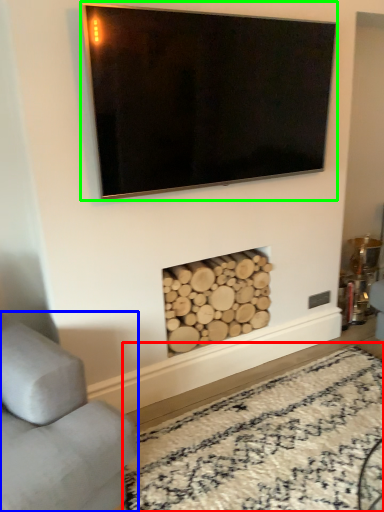
Question: Estimate the real-world distances between objects in this image. Which object is closer to plain (highlighted by a red box), studio couch (highlighted by a blue box) or television (highlighted by a green box)?

Choices:
 (A) studio couch
 (B) television

Answer: (A)